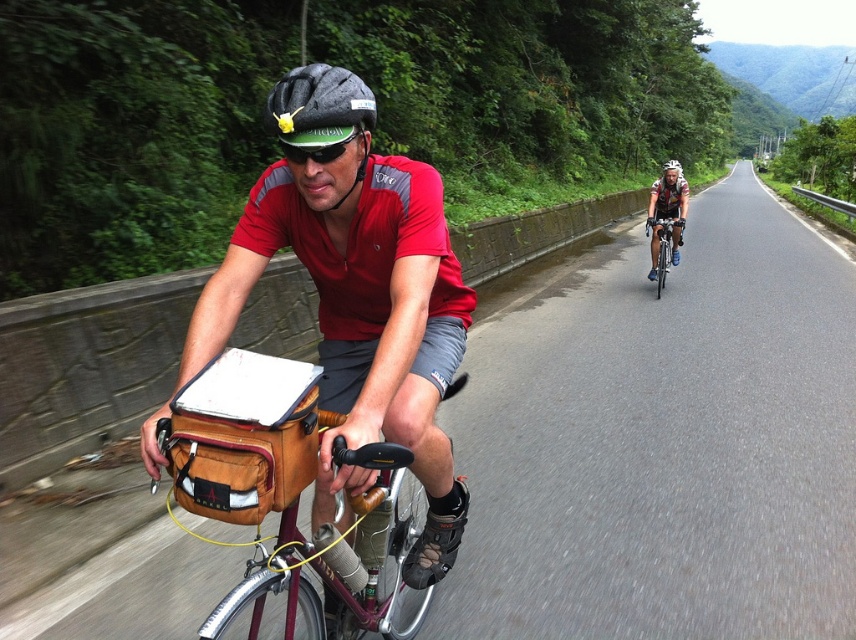
Question: Can you confirm if leather/canvas bag at center is positioned to the right of matte black helmet at upper center?

Choices:
 (A) yes
 (B) no

Answer: (B)

Question: Can you confirm if leather/canvas bag at center is positioned below matte black helmet at upper center?

Choices:
 (A) yes
 (B) no

Answer: (A)

Question: Which point appears closest to the camera in this image?

Choices:
 (A) (681, 205)
 (B) (321, 157)
 (C) (254, 577)
 (D) (788, 342)

Answer: (C)

Question: Is leather/canvas bag at center to the left of matte black helmet at center from the viewer's perspective?

Choices:
 (A) yes
 (B) no

Answer: (B)

Question: Among these points, which one is nearest to the camera?

Choices:
 (A) (835, 605)
 (B) (657, 252)

Answer: (A)

Question: Which point is closer to the camera?

Choices:
 (A) leather/canvas bag at center
 (B) black matte bicycle helmet at upper center

Answer: (A)